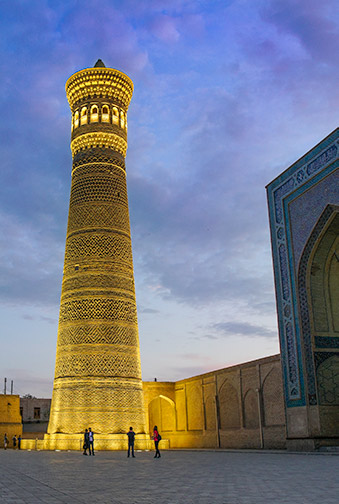
Find the location of a particular element. The height and width of the screenshot is (504, 339). arch is located at coordinates (157, 416).